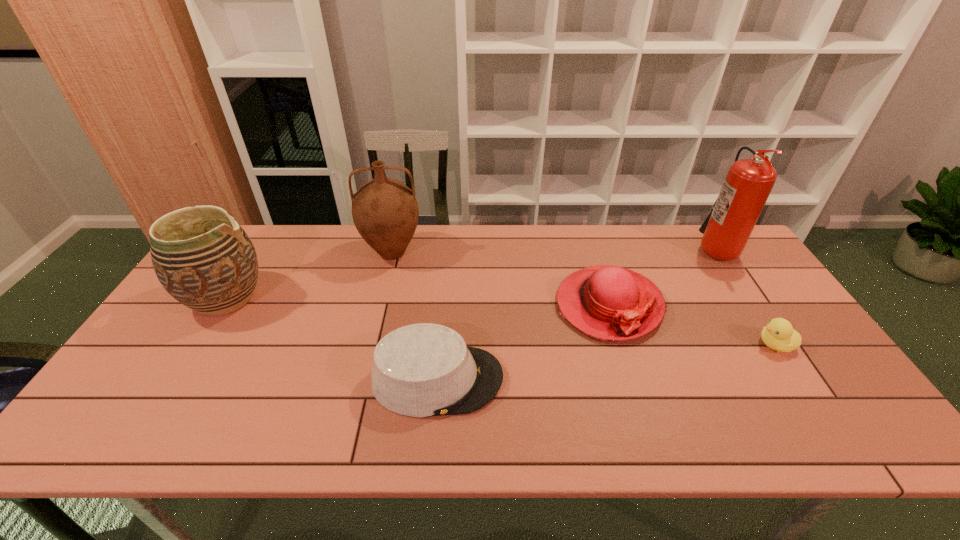
The height and width of the screenshot is (540, 960). I want to click on fire extinguisher, so [x=748, y=184].

What are the coordinates of `the second tallest object` in the screenshot? It's located at (385, 211).

At what (x,y) coordinates should I click in order to perform the action: click on pottery. Please return your answer as a coordinate pair (x, y). The height and width of the screenshot is (540, 960). Looking at the image, I should click on pos(206,261).

The height and width of the screenshot is (540, 960). What are the coordinates of `the third tallest object` in the screenshot? It's located at (206, 261).

At what (x,y) coordinates should I click in order to perform the action: click on the right hat. Please return your answer as a coordinate pair (x, y). Looking at the image, I should click on (608, 302).

Find the location of a particular element. This screenshot has height=540, width=960. the left hat is located at coordinates (421, 370).

Image resolution: width=960 pixels, height=540 pixels. In order to click on duckling in this screenshot , I will do `click(779, 335)`.

Find the location of a particular element. vacant space located 0.360m on the instruction side of the tallest object is located at coordinates (590, 247).

At what (x,y) coordinates should I click in order to perform the action: click on free space located 0.290m on the instruction side of the tallest object. Please return your answer as a coordinate pair (x, y). Looking at the image, I should click on (611, 247).

Locate an element on the screen. The image size is (960, 540). blank space located 0.280m on the instruction side of the tallest object is located at coordinates (613, 247).